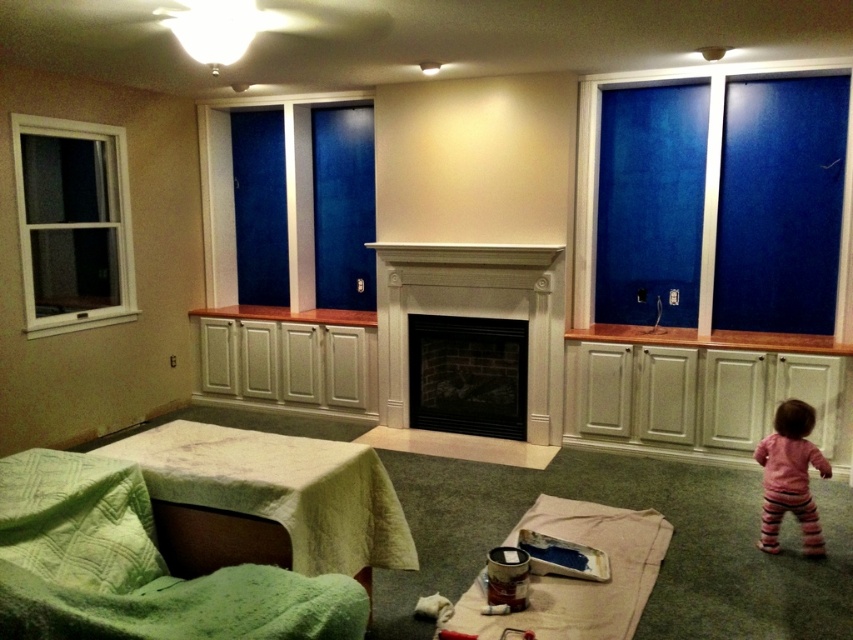
Question: Does white frame window at left appear on the right side of white wood fireplace at center?

Choices:
 (A) no
 (B) yes

Answer: (A)

Question: Based on their relative distances, which object is nearer to the black brick fireplace at center?

Choices:
 (A) pink striped pants at lower right
 (B) white wood fireplace at center
 (C) white frame window at left

Answer: (B)

Question: Which of the following is the closest to the observer?

Choices:
 (A) white frame window at left
 (B) black brick fireplace at center

Answer: (A)

Question: Which of the following is the closest to the observer?

Choices:
 (A) white wood fireplace at center
 (B) black brick fireplace at center

Answer: (A)

Question: Where is white frame window at left located in relation to black brick fireplace at center in the image?

Choices:
 (A) below
 (B) above

Answer: (B)

Question: Is the position of white wood fireplace at center less distant than that of black brick fireplace at center?

Choices:
 (A) no
 (B) yes

Answer: (B)